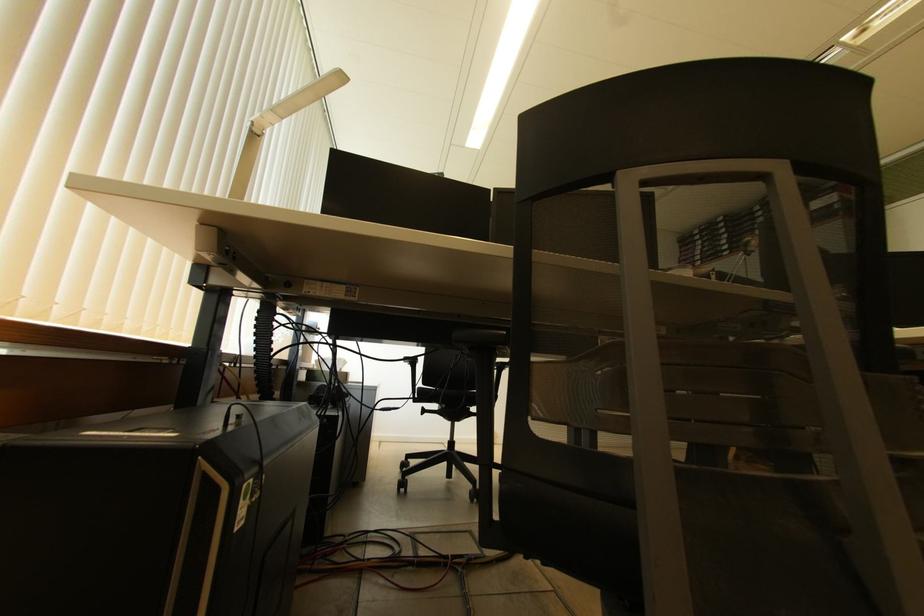
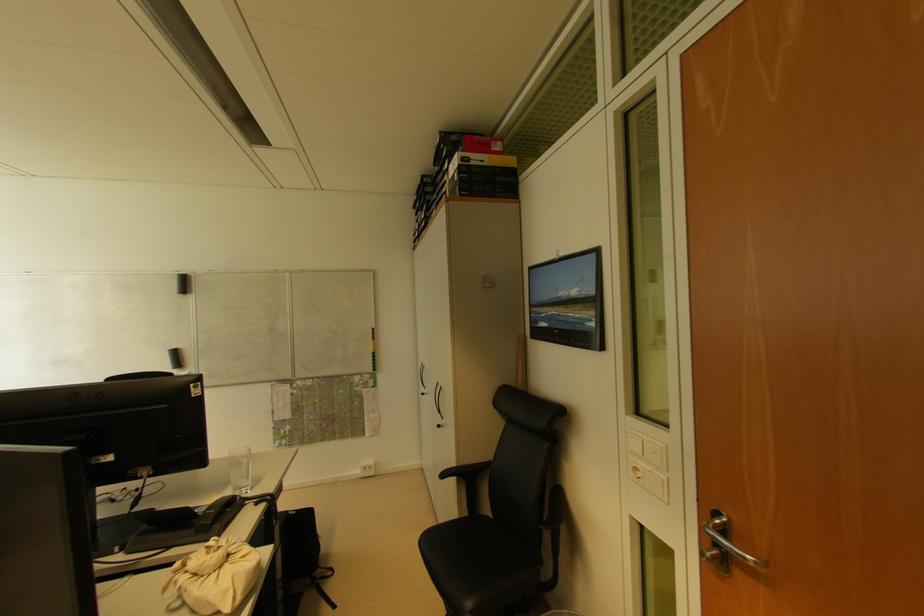
Question: The images are taken continuously from a first-person perspective. In which direction are you moving?

Choices:
 (A) Left
 (B) Right
 (C) Forward
 (D) Backward

Answer: (B)